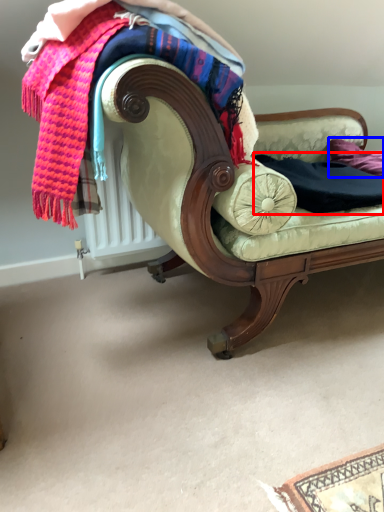
Question: Which point is further to the camera, clothing (highlighted by a red box) or pillow (highlighted by a blue box)?

Choices:
 (A) clothing
 (B) pillow

Answer: (B)